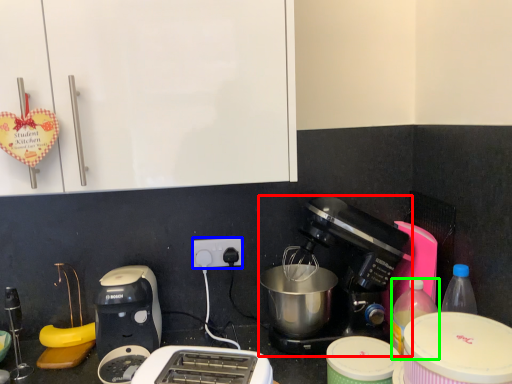
Question: Estimate the real-world distances between objects in this image. Which object is farther from coffee maker (highlighted by a red box), power plugs and sockets (highlighted by a blue box) or bottle (highlighted by a green box)?

Choices:
 (A) power plugs and sockets
 (B) bottle

Answer: (A)